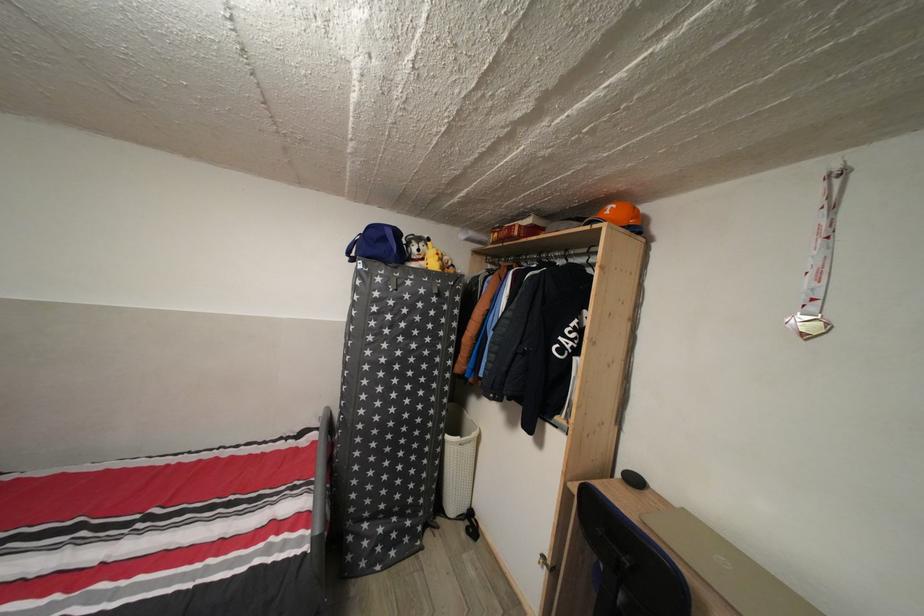
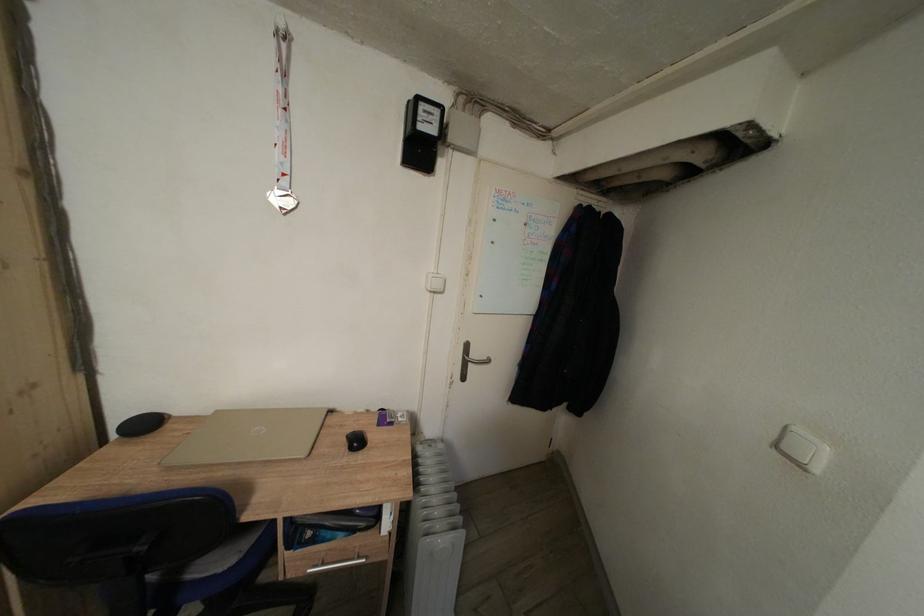
The first image is from the beginning of the video and the second image is from the end. How did the camera likely rotate when shooting the video?

The camera rotated toward right-down.